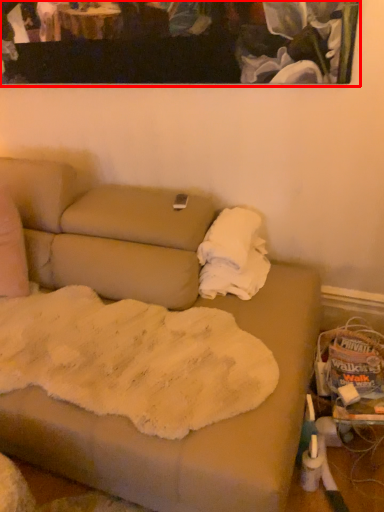
Question: From the image's perspective, where is picture frame (annotated by the red box) located relative to cloth?

Choices:
 (A) above
 (B) below

Answer: (A)